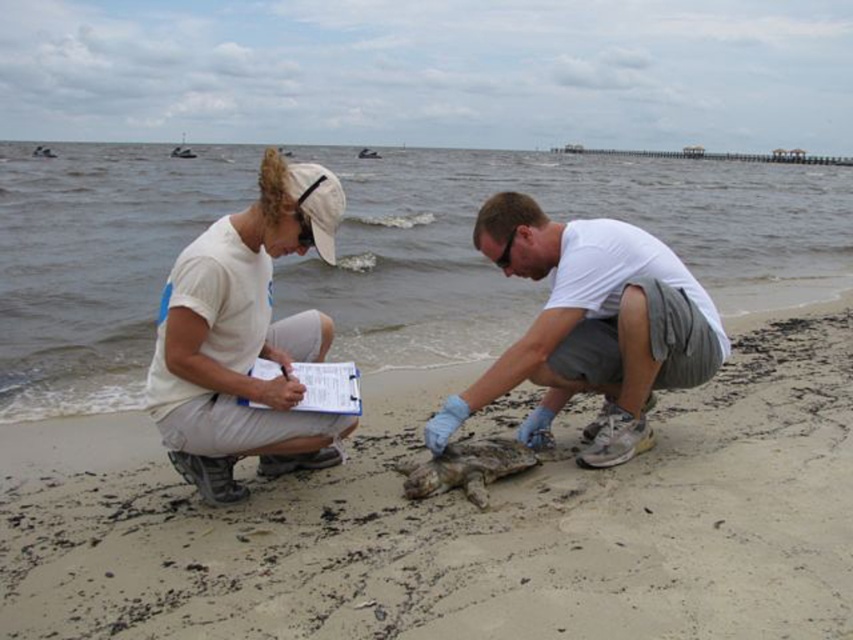
You are a marine biologist observing a sandy beach at center and a matte gray turtle at center. Which object is positioned lower in the image?

The sandy beach at center is located below the matte gray turtle at center, so the sandy beach at center is positioned lower in the image.

You are a marine biologist observing the scene. You need to place a new research station between the sandy beach at center and the white paper clipboard at center. Which object should the station be closer to based on their positions?

The sandy beach at center is in front of the white paper clipboard at center, so the research station should be placed closer to the white paper clipboard at center to maintain proximity to both objects.

You are a marine biologist observing the scene. You need to place a protective cover over the white paper clipboard at center to shield it from the rain. Where should you place the cover relative to the sandy beach at center?

The sandy beach at center is located below the white paper clipboard at center, so you should place the protective cover above the sandy beach at center to shield the white paper clipboard at center from the rain.